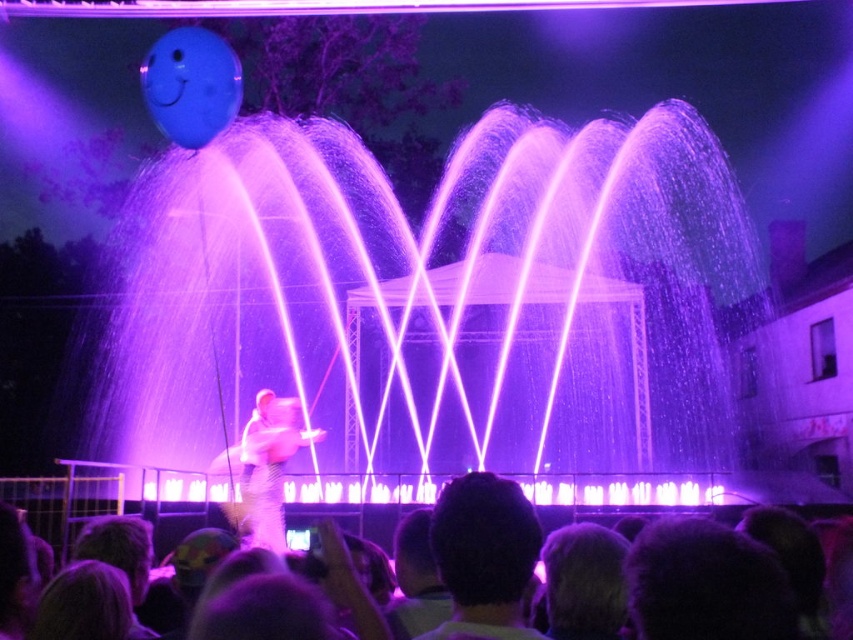
Question: Which point is closer to the camera taking this photo?

Choices:
 (A) (166, 506)
 (B) (281, 444)
 (C) (706, 346)

Answer: (B)

Question: Among these objects, which one is farthest from the camera?

Choices:
 (A) white fluffy costume at center
 (B) silky hair at lower center

Answer: (A)

Question: Does purple translucent water at center have a greater width compared to silky hair at lower center?

Choices:
 (A) yes
 (B) no

Answer: (A)

Question: Can you confirm if silky hair at lower center is positioned to the left of white fluffy costume at center?

Choices:
 (A) no
 (B) yes

Answer: (A)

Question: Estimate the real-world distances between objects in this image. Which object is farther from the purple translucent water at center?

Choices:
 (A) white fluffy costume at center
 (B) silky hair at lower center

Answer: (B)

Question: Can you confirm if purple translucent water at center is positioned to the left of silky hair at lower center?

Choices:
 (A) yes
 (B) no

Answer: (B)